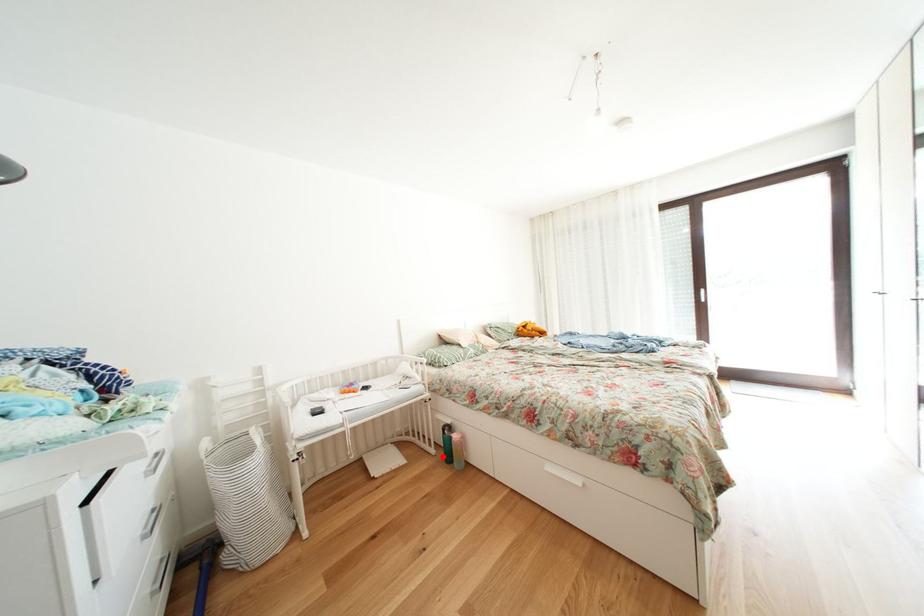
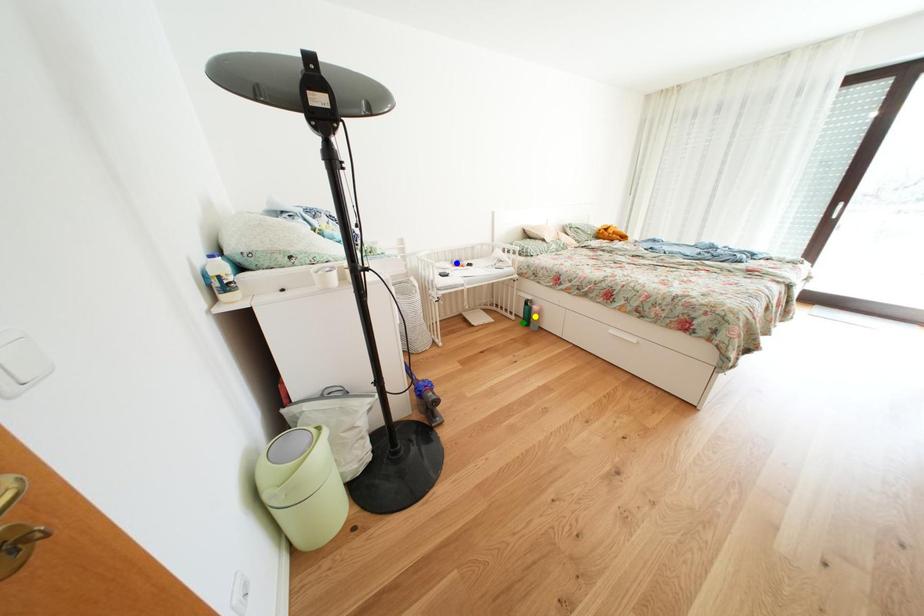
Question: I am providing you with two images of the same scene from different viewpoints. A red point is marked on the first image. You are given multiple points on the second image. Which spot in image 2 lines up with the point in image 1?

Choices:
 (A) yellow point
 (B) green point
 (C) blue point

Answer: (B)